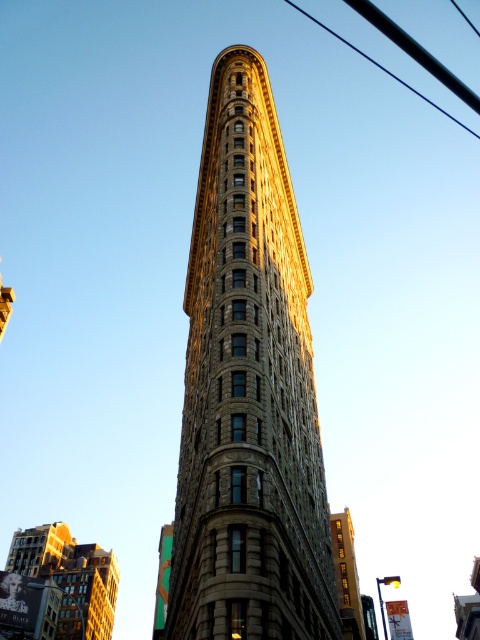
Question: Estimate the real-world distances between objects in this image. Which object is farther from the black wire at upper right?

Choices:
 (A) brown stone building at lower right
 (B) brown stone building at center
 (C) brown stone building at lower left

Answer: (B)

Question: Which object is positioned closest to the black wire at upper right?

Choices:
 (A) brown stone building at lower right
 (B) brown stone building at center

Answer: (A)

Question: Does brown stone building at center come in front of brown stone building at lower left?

Choices:
 (A) no
 (B) yes

Answer: (B)

Question: Can you confirm if brown stone building at center is wider than brown stone building at lower right?

Choices:
 (A) yes
 (B) no

Answer: (A)

Question: Which point appears closest to the camera in this image?

Choices:
 (A) (216, 483)
 (B) (408, 84)

Answer: (A)

Question: Is brown stone building at center below brown stone building at lower right?

Choices:
 (A) no
 (B) yes

Answer: (A)